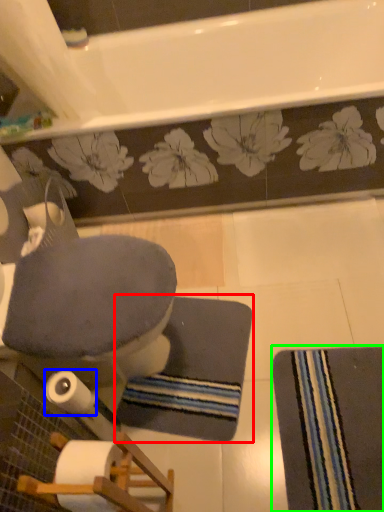
Question: Estimate the real-world distances between objects in this image. Which object is farther from bath mat (highlighted by a red box), toilet paper (highlighted by a blue box) or doormat (highlighted by a green box)?

Choices:
 (A) toilet paper
 (B) doormat

Answer: (A)